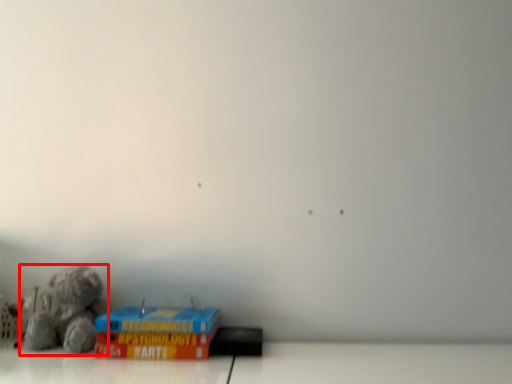
Question: Where is toy (annotated by the red box) located in relation to cardboard box in the image?

Choices:
 (A) left
 (B) right

Answer: (A)